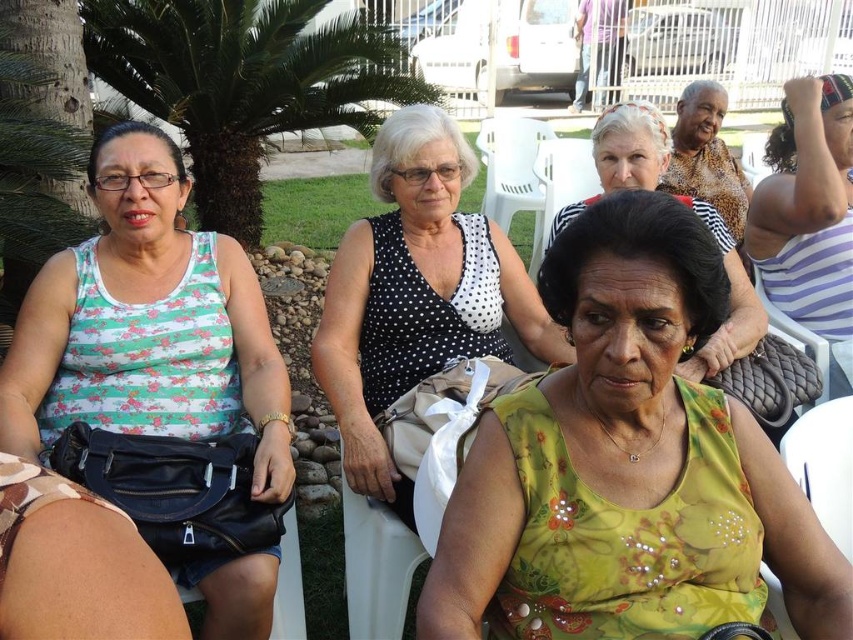
Question: In this image, where is green sequined blouse at center located relative to white plastic chair at center?

Choices:
 (A) below
 (B) above

Answer: (A)

Question: Estimate the real-world distances between objects in this image. Which object is closer to the printed fabric dress at upper right?

Choices:
 (A) striped fabric shirt at upper right
 (B) green floral dress at center
 (C) white plastic chair at center

Answer: (A)

Question: In this image, where is striped fabric shirt at upper right located relative to printed fabric dress at upper right?

Choices:
 (A) above
 (B) below

Answer: (B)

Question: Which of the following is the farthest from the observer?

Choices:
 (A) matte green and white striped tank top at left
 (B) striped fabric shirt at upper right
 (C) white plastic chair at center
 (D) green leafy palm tree at upper left

Answer: (C)

Question: Can you confirm if green leafy palm tree at upper left is positioned below printed fabric dress at upper right?

Choices:
 (A) no
 (B) yes

Answer: (A)

Question: Which of the following is the closest to the observer?

Choices:
 (A) green floral dress at center
 (B) black dotted dress at center
 (C) striped fabric shirt at upper right
 (D) printed fabric dress at upper right

Answer: (B)